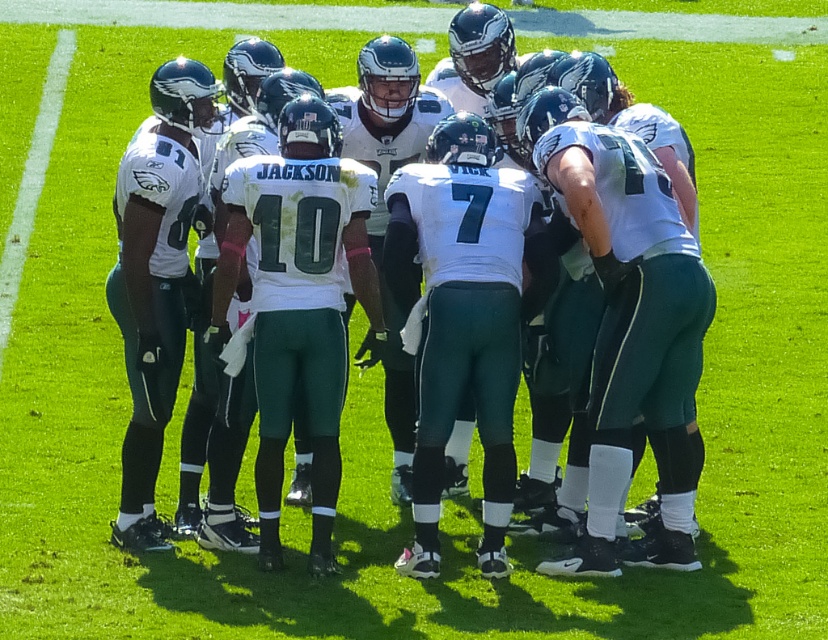
Question: Can you confirm if white jersey at center is wider than white painted line at lower left?

Choices:
 (A) yes
 (B) no

Answer: (A)

Question: Does white jersey at center appear on the right side of white painted line at lower left?

Choices:
 (A) no
 (B) yes

Answer: (B)

Question: Which of the following is the farthest from the observer?

Choices:
 (A) (432, 374)
 (B) (11, 243)

Answer: (B)

Question: Which of the following is the closest to the observer?

Choices:
 (A) white jersey at center
 (B) white painted line at lower left

Answer: (A)

Question: Is white jersey at center to the left of white painted line at lower left from the viewer's perspective?

Choices:
 (A) no
 (B) yes

Answer: (A)